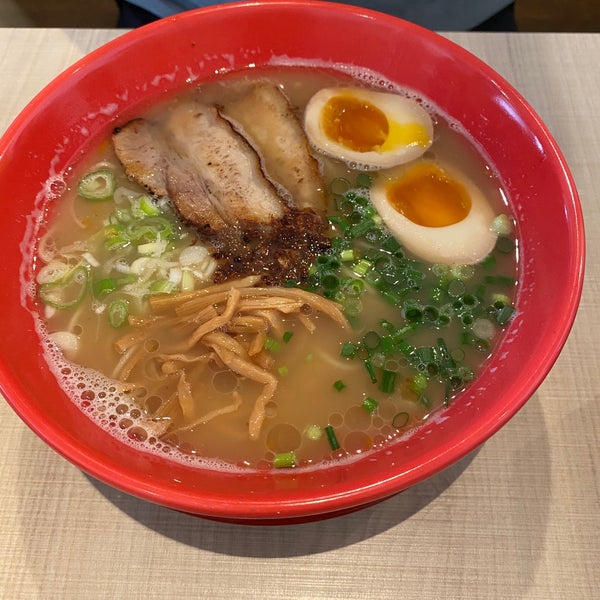
You are a GUI agent. You are given a task and a screenshot of the screen. Output one action in this format:
    pyautogui.click(x=<x>, y=<y>)
    Task: Click on the red round bowl edge
    This screenshot has height=600, width=600.
    Given the screenshot: What is the action you would take?
    pyautogui.click(x=336, y=491)